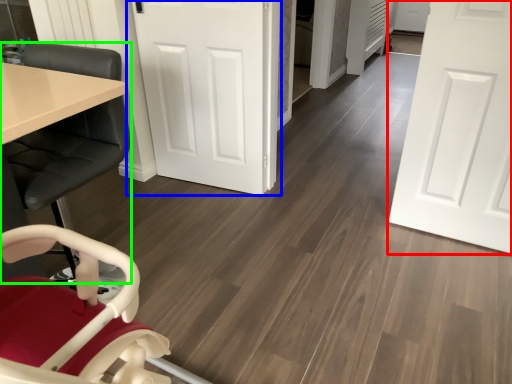
Question: Which object is the closest to the door (highlighted by a red box)? Choose among these: door (highlighted by a blue box) or chair (highlighted by a green box).

Choices:
 (A) door
 (B) chair

Answer: (A)